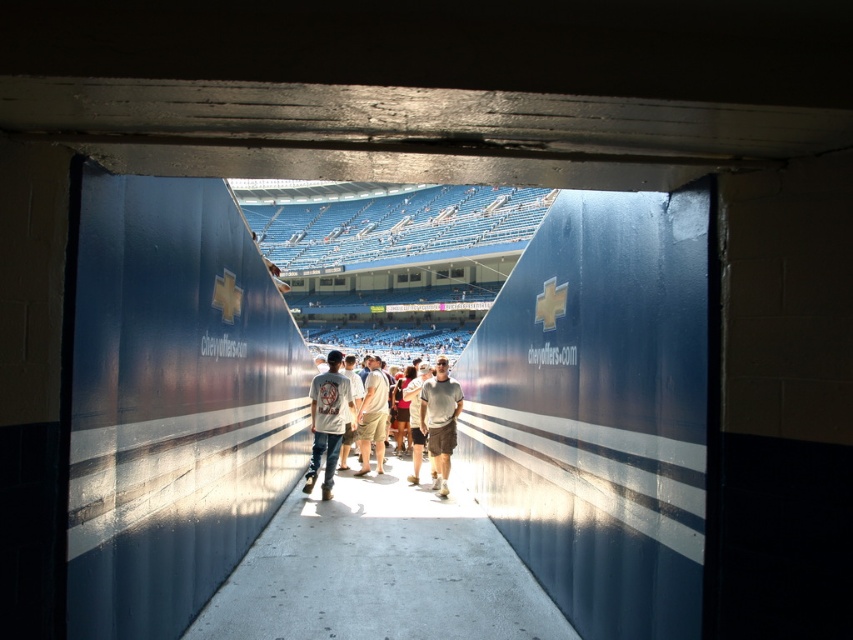
Question: Is light gray cotton t-shirt at center wider than gray cotton t-shirt at center?

Choices:
 (A) yes
 (B) no

Answer: (A)

Question: Where is light gray cotton t-shirt at center located in relation to light brown cotton shorts at center in the image?

Choices:
 (A) below
 (B) above

Answer: (B)

Question: Which is farther from the white t-shirt at center?

Choices:
 (A) white cotton t-shirt at center
 (B) light brown cotton shorts at center
 (C) light gray cotton t-shirt at center
 (D) gray cotton t-shirt at center

Answer: (D)

Question: Which point is farther to the camera?

Choices:
 (A) gray cotton t-shirt at center
 (B) light gray cotton t-shirt at center
 (C) light brown cotton shorts at center
 (D) white t-shirt at center

Answer: (C)

Question: Estimate the real-world distances between objects in this image. Which object is closer to the white cotton t-shirt at center?

Choices:
 (A) light gray cotton t-shirt at center
 (B) white t-shirt at center
 (C) light brown cotton shorts at center
 (D) gray cotton t-shirt at center

Answer: (B)

Question: Is light brown cotton shorts at center in front of white t-shirt at center?

Choices:
 (A) no
 (B) yes

Answer: (A)